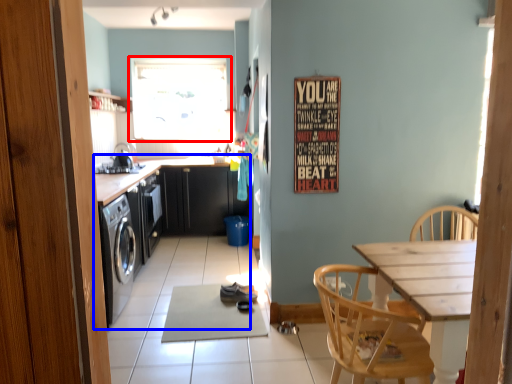
Question: Which object appears closest to the camera in this image, window (highlighted by a red box) or cabinetry (highlighted by a blue box)?

Choices:
 (A) window
 (B) cabinetry

Answer: (B)